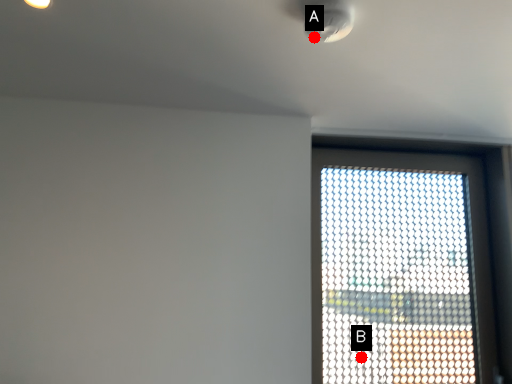
Question: Two points are circled on the image, labeled by A and B beside each circle. Among these points, which one is farthest from the camera?

Choices:
 (A) A is further
 (B) B is further

Answer: (B)